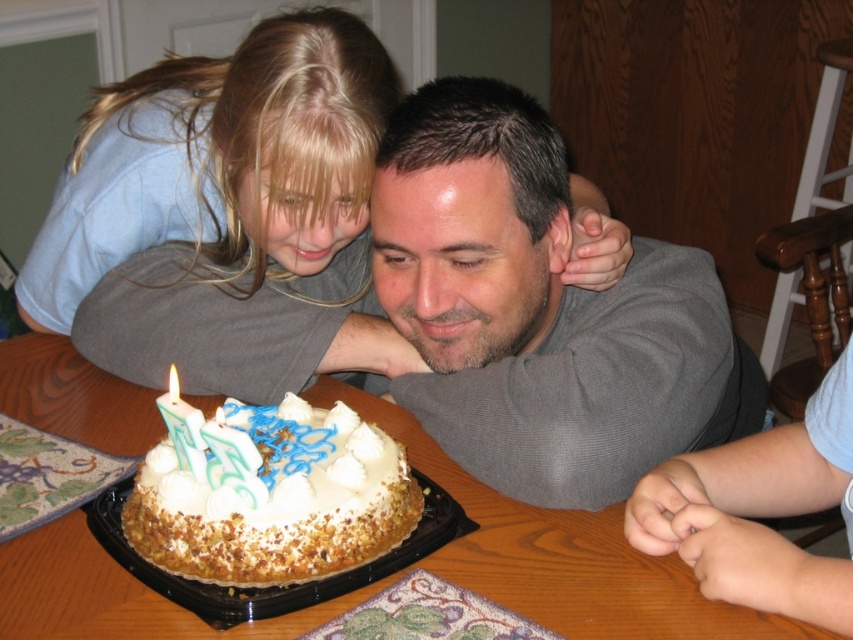
You are standing in front of the birthday cake and want to place a small decoration on the table. You have two points marked on the table surface where you can place it. The first point is at coordinates point [119,230] and the second point is at point [18,344]. Which point is closer to you so that the decoration is more visible?

Point [119,230] is closer to the viewer than point [18,344], so placing the decoration there will make it more visible.

What is located at the coordinates point (219,161) in the image?

The point at coordinates (219,161) indicates blonde hair at upper left.

You are a photographer taking a picture of the birthday scene. You need to ensure that both the blonde hair at upper left and the green wax candle at center are in focus. Given that your camera can only focus on objects within a 10 inch range, will both be in focus?

The distance between the blonde hair at upper left and the green wax candle at center is 12.95 inches. Since the camera can only focus within a 10 inch range, they are outside the focus range and cannot both be in focus.